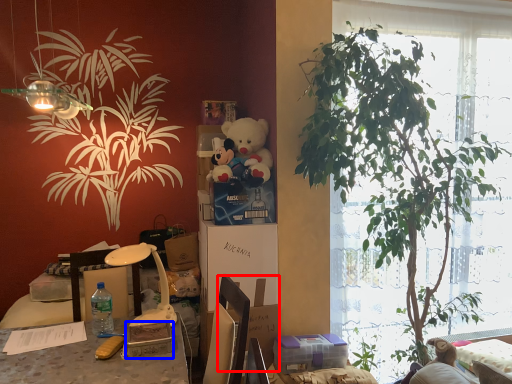
Question: Which of the following is the closest to the observer, cardboard box (highlighted by a red box) or box (highlighted by a blue box)?

Choices:
 (A) cardboard box
 (B) box

Answer: (B)